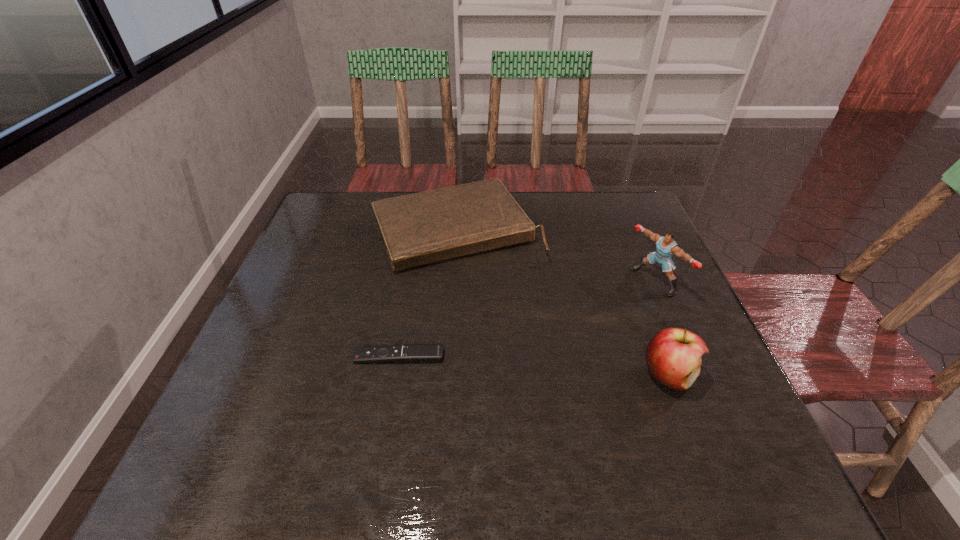
Find the location of `vacant region located 0.250m on the spine side of the second shortest object`. vacant region located 0.250m on the spine side of the second shortest object is located at coordinates pyautogui.click(x=528, y=341).

Identify the location of object that is at the far edge. Image resolution: width=960 pixels, height=540 pixels. (425, 227).

Identify the location of object located at the near edge. (673, 356).

You are a GUI agent. You are given a task and a screenshot of the screen. Output one action in this format:
    pyautogui.click(x=<x>, y=<y>)
    Task: Click on the apple that is positioned at the right edge
    The image size is (960, 540).
    Given the screenshot: What is the action you would take?
    pyautogui.click(x=673, y=356)

I want to click on puncher situated at the right edge, so click(666, 246).

The height and width of the screenshot is (540, 960). Find the location of `object located in the near right corner section of the desktop`. object located in the near right corner section of the desktop is located at coordinates (673, 356).

Identify the location of vacant position at the far edge of the desktop. (559, 197).

Locate an element on the screen. The width and height of the screenshot is (960, 540). free space at the left edge of the desktop is located at coordinates (291, 272).

The width and height of the screenshot is (960, 540). Find the location of `vacant area at the right edge`. vacant area at the right edge is located at coordinates (657, 288).

The width and height of the screenshot is (960, 540). What are the coordinates of `vacant region at the far left corner` in the screenshot? It's located at (337, 197).